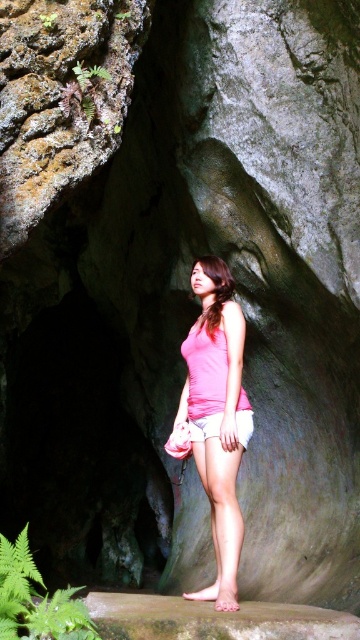
You are a photographer trying to capture the person in the cave. The person is standing at point (217, 417). You want to place a tripod at point 0.5, 0.5 to get the best angle. Will the tripod be directly in front of the pink fabric shorts at center?

The pink fabric shorts at center is located at point (217, 417), so placing the tripod at 0.5, 0.5 would position it slightly to the left and above the pink fabric shorts at center, meaning it would not be directly in front.

You are a fashion designer observing the person in the cave. You notice they have two pairs of shorts, the pink fabric shorts at center and the white cotton shorts at center. Which pair of shorts is larger in size?

The pink fabric shorts at center is bigger than the white cotton shorts at center, so the pink fabric shorts at center is the larger pair.